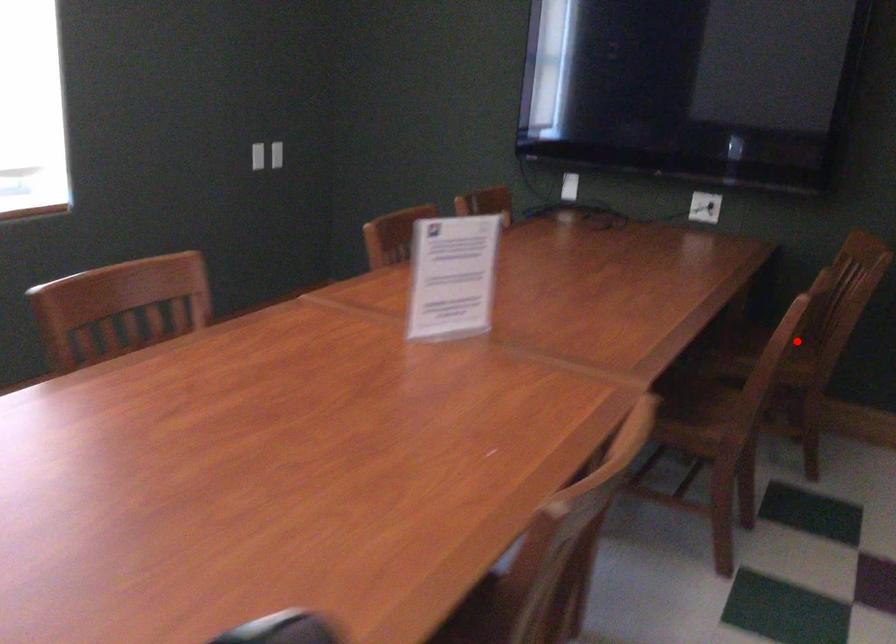
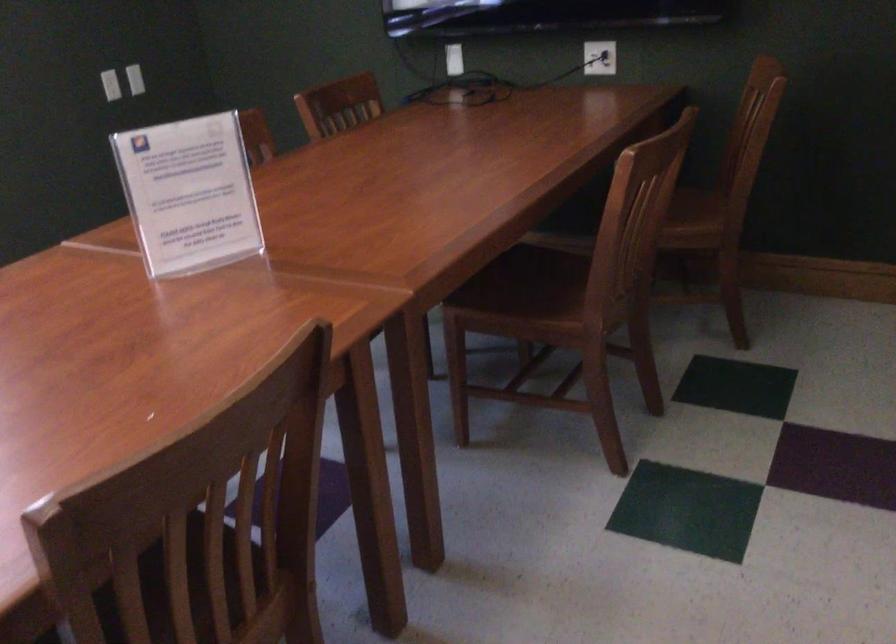
Question: I am providing you with two images of the same scene from different viewpoints. A red point is shown in image1. For the corresponding object point in image2, is it positioned nearer or farther from the camera?

Choices:
 (A) Nearer
 (B) Farther

Answer: (A)